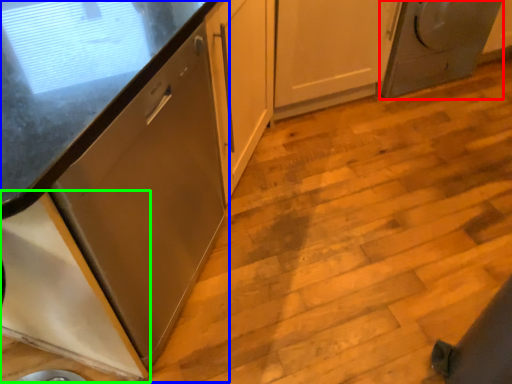
Question: Which object is the farthest from home appliance (highlighted by a red box)? Choose among these: cabinetry (highlighted by a blue box) or cabinetry (highlighted by a green box).

Choices:
 (A) cabinetry
 (B) cabinetry

Answer: (B)